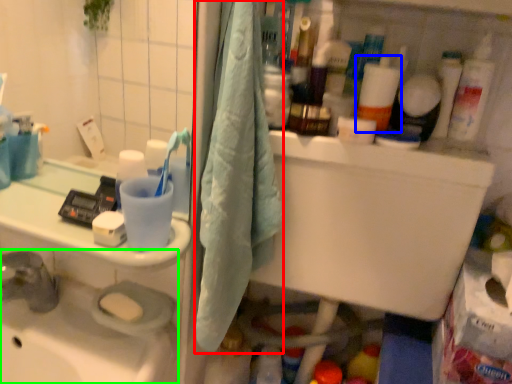
Question: Which object is positioned closest to bath towel (highlighted by a red box)? Select from cleaning product (highlighted by a blue box) and sink (highlighted by a green box).

Choices:
 (A) cleaning product
 (B) sink

Answer: (A)